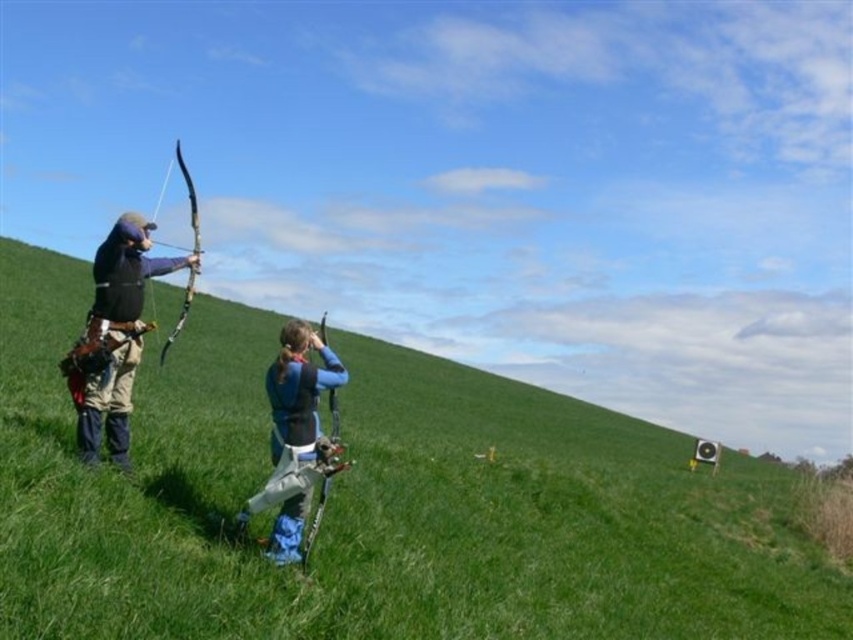
You are a coach observing two archers practicing on a grassy slope. You notice the blue fabric bow at center and the wooden bow at left. If you want to walk between them to give feedback, will there be enough space? The path between them is straight and clear.

The distance between the blue fabric bow at center and wooden bow at left is 16.17 meters, so there is ample space to walk between them as the distance is more than sufficient for a coach to move comfortably.

In the scene shown: You are standing at the origin point of the coordinate system. You want to walk to the green grassy hillside at center. In which direction should you move?

The green grassy hillside at center is located at coordinate point (x=375, y=502). Since the x and y coordinates are both positive, you should move in the northeast direction to reach it.